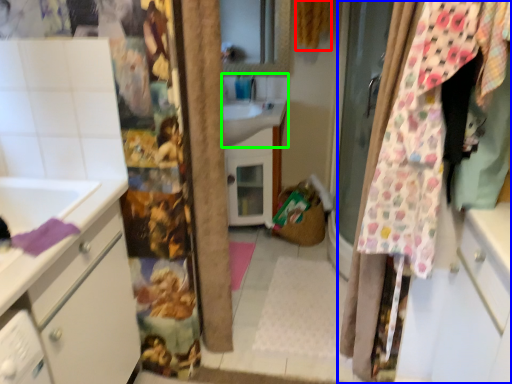
Question: Which is farther away from curtain (highlighted by a red box)? curtain (highlighted by a blue box) or sink (highlighted by a green box)?

Choices:
 (A) curtain
 (B) sink

Answer: (A)